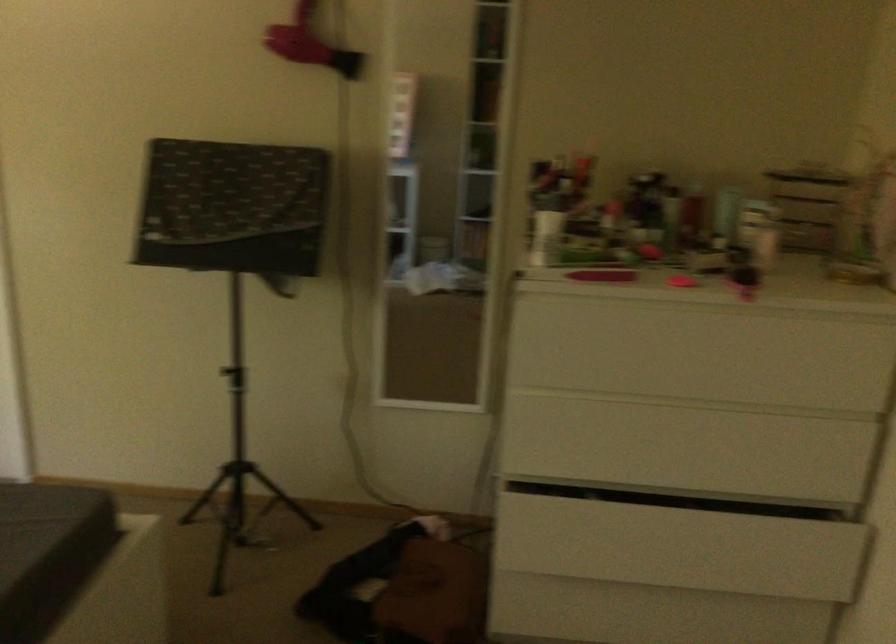
Describe the element at coordinates (38, 523) in the screenshot. This screenshot has width=896, height=644. I see `a sofa sitting surface` at that location.